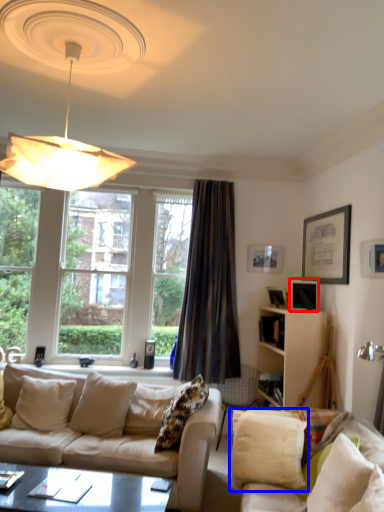
Question: Among these objects, which one is farthest to the camera, picture frame (highlighted by a red box) or pillow (highlighted by a blue box)?

Choices:
 (A) picture frame
 (B) pillow

Answer: (A)